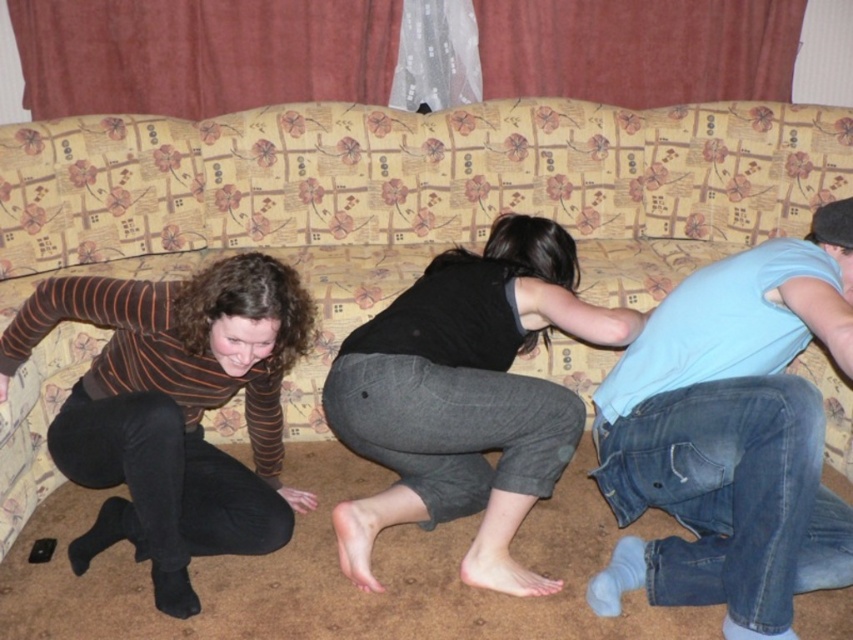
You are standing in the living room and want to walk from the sofa to the door. There are two objects in your path. Which direction should you move to avoid the blue denim jeans at lower right and the black matte pants at center?

To avoid both the blue denim jeans at lower right and the black matte pants at center, you should move to the left since the blue denim jeans at lower right is to the right of the black matte pants at center, meaning they are positioned further to your right. Moving left would allow you to bypass both objects safely.

You are standing at the origin point in the room. The coordinates are given in a normalized system where the bottom left corner is the origin. Where is the blue denim jeans at lower right located?

The blue denim jeans at lower right is located at coordinates point (730,435).